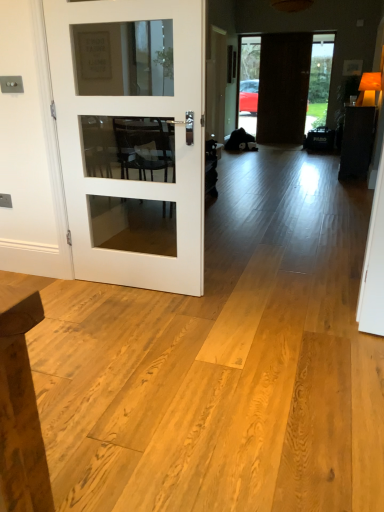
Question: Is dark brown wooden door at center, which is the first door from back to front, to the left or to the right of white glass door at left, which appears as the second door when viewed from the right, in the image?

Choices:
 (A) right
 (B) left

Answer: (A)

Question: Is dark brown wooden door at center, which ranks as the 2th door in bottom-to-top order, situated inside white glass door at left, which appears as the 2th door when viewed from the back, or outside?

Choices:
 (A) outside
 (B) inside

Answer: (A)

Question: From a real-world perspective, is dark brown wooden door at center, the second door when ordered from left to right, physically located above or below white glass door at left, which ranks as the first door in bottom-to-top order?

Choices:
 (A) below
 (B) above

Answer: (B)

Question: In the image, is white glass door at left, which appears as the first door when viewed from the front, on the left side or the right side of dark brown wooden door at center, arranged as the 2th door when viewed from the front?

Choices:
 (A) left
 (B) right

Answer: (A)

Question: Is white glass door at left, which appears as the 2th door when viewed from the back, in front of or behind dark brown wooden door at center, the first door when ordered from top to bottom, in the image?

Choices:
 (A) front
 (B) behind

Answer: (A)

Question: Does point tap(72, 124) appear closer or farther from the camera than point tap(301, 45)?

Choices:
 (A) closer
 (B) farther

Answer: (A)

Question: Is white glass door at left, which appears as the first door when viewed from the front, wider or thinner than dark brown wooden door at center, the first door when ordered from top to bottom?

Choices:
 (A) thin
 (B) wide

Answer: (B)